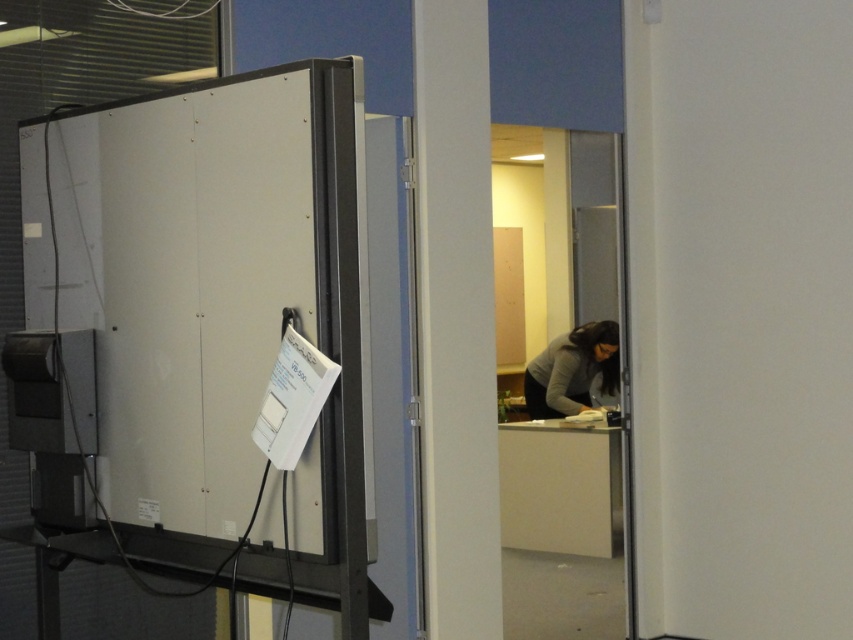
You are standing in the office and want to reach the dark gray sweater at lower center without moving the white smooth pillar at center. Is this possible?

The white smooth pillar at center is closer to the viewer than the dark gray sweater at lower center, so you cannot reach the dark gray sweater at lower center without moving the white smooth pillar at center.

You are an interior designer assessing the layout of this office space. You need to place a new desk between the white smooth pillar at center and the dark gray sweater at lower center. Which object should the desk be placed closer to in order to maximize space efficiency?

The desk should be placed closer to the white smooth pillar at center because it has a lesser width compared to the dark gray sweater at lower center, allowing more space for the desk on the wider side.

You are standing in the office and see the point at coordinates (456, 320). According to the image, what object is this point located on?

The point at coordinates (456, 320) is located on the white smooth pillar at center.